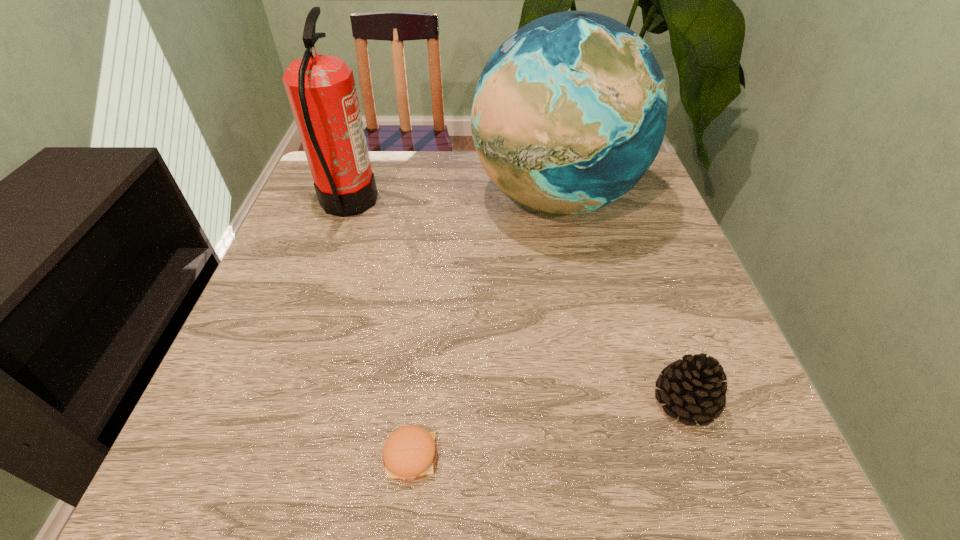
The image size is (960, 540). I want to click on vacant space located on the left of the patty, so click(294, 456).

Image resolution: width=960 pixels, height=540 pixels. Identify the location of globe located at the far edge. (569, 113).

Where is `fire extinguisher present at the far edge`? Image resolution: width=960 pixels, height=540 pixels. fire extinguisher present at the far edge is located at coordinates (321, 89).

Locate an element on the screen. Image resolution: width=960 pixels, height=540 pixels. object located at the near edge is located at coordinates click(409, 453).

I want to click on object situated at the left edge, so click(321, 89).

The image size is (960, 540). Find the location of `globe that is at the right edge`. globe that is at the right edge is located at coordinates (569, 113).

Locate an element on the screen. The height and width of the screenshot is (540, 960). pinecone at the right edge is located at coordinates (692, 387).

Where is `object that is at the far left corner`? This screenshot has width=960, height=540. object that is at the far left corner is located at coordinates (321, 89).

Find the location of a particular element. The width and height of the screenshot is (960, 540). object situated at the far right corner is located at coordinates (569, 113).

The height and width of the screenshot is (540, 960). In the image, there is a desktop. In order to click on vacant space at the far edge in this screenshot , I will do `click(394, 193)`.